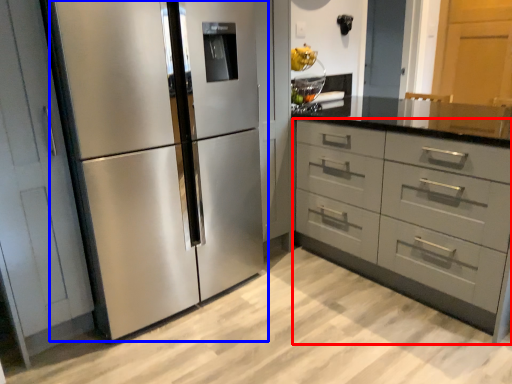
Question: Among these objects, which one is nearest to the camera, chest of drawers (highlighted by a red box) or refrigerator (highlighted by a blue box)?

Choices:
 (A) chest of drawers
 (B) refrigerator

Answer: (B)